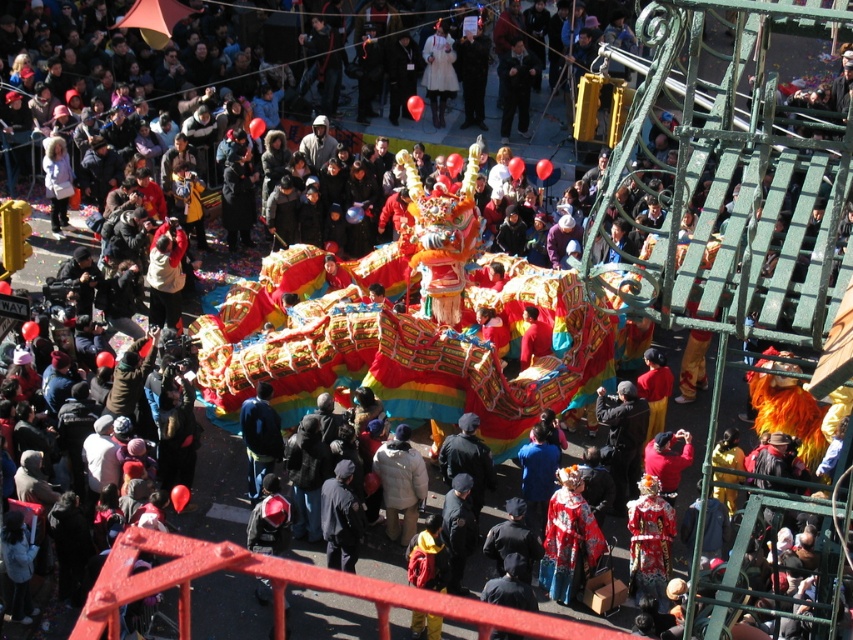
Question: From the image, what is the correct spatial relationship of embroidered silk costume at center in relation to dark gray fabric jacket at center?

Choices:
 (A) above
 (B) below

Answer: (B)

Question: Can you confirm if embroidered silk costume at center is smaller than white puffy coat at center?

Choices:
 (A) yes
 (B) no

Answer: (B)

Question: Which object appears closest to the camera in this image?

Choices:
 (A) embroidered silk costume at center
 (B) white puffy coat at center

Answer: (A)

Question: Can you confirm if white puffy coat at center is positioned to the left of dark gray fabric jacket at center?

Choices:
 (A) no
 (B) yes

Answer: (A)

Question: Which object is positioned farthest from the embroidered silk costume at center?

Choices:
 (A) white puffy coat at center
 (B) red satin costume at center

Answer: (A)

Question: Which of the following is the farthest from the observer?

Choices:
 (A) embroidered silk costume at center
 (B) dark gray fabric jacket at center
 (C) white puffy coat at center
 (D) red satin costume at center

Answer: (C)